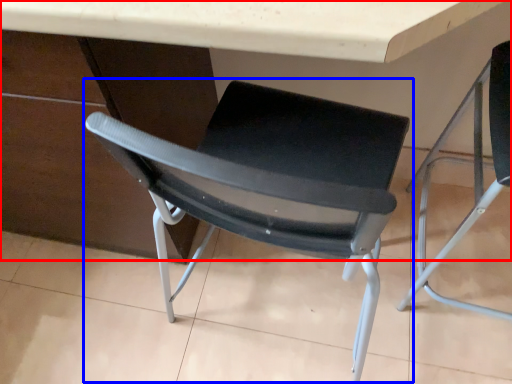
Question: Which object is further to the camera taking this photo, table (highlighted by a red box) or chair (highlighted by a blue box)?

Choices:
 (A) table
 (B) chair

Answer: (B)